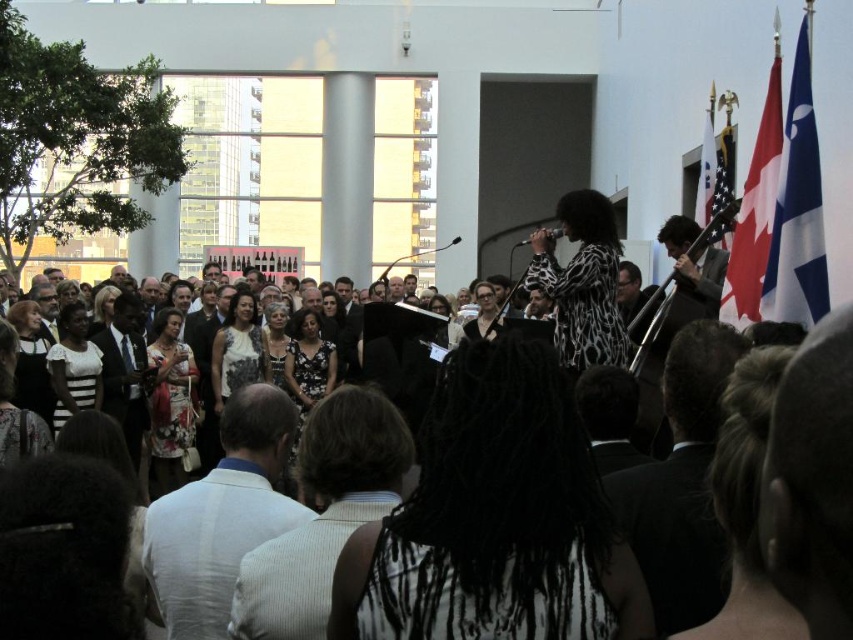
Does floral dress at center appear over white lace dress at center?

Actually, floral dress at center is below white lace dress at center.

Is floral dress at center to the left of white lace dress at center from the viewer's perspective?

Yes, floral dress at center is to the left of white lace dress at center.

Image resolution: width=853 pixels, height=640 pixels. In order to click on floral dress at center in this screenshot , I will do `click(170, 403)`.

Find the location of a particular element. The image size is (853, 640). floral dress at center is located at coordinates (170, 403).

Does white textured hair at center appear over matte black dress at center?

Incorrect, white textured hair at center is not positioned above matte black dress at center.

Is white textured hair at center behind matte black dress at center?

No, white textured hair at center is in front of matte black dress at center.

Which is in front, point (480, 630) or point (485, 301)?

Positioned in front is point (480, 630).

I want to click on white textured hair at center, so click(494, 518).

Does white corduroy suit at center have a greater height compared to white dress at center?

Correct, white corduroy suit at center is much taller as white dress at center.

Does white corduroy suit at center have a smaller size compared to white dress at center?

No.

The image size is (853, 640). I want to click on white corduroy suit at center, so click(x=222, y=515).

The image size is (853, 640). In order to click on white corduroy suit at center in this screenshot , I will do `click(222, 515)`.